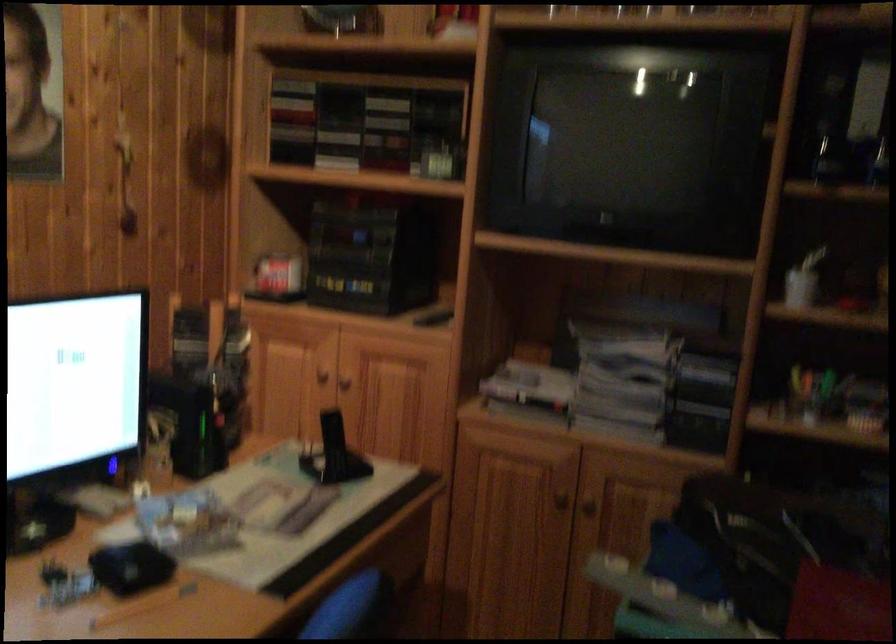
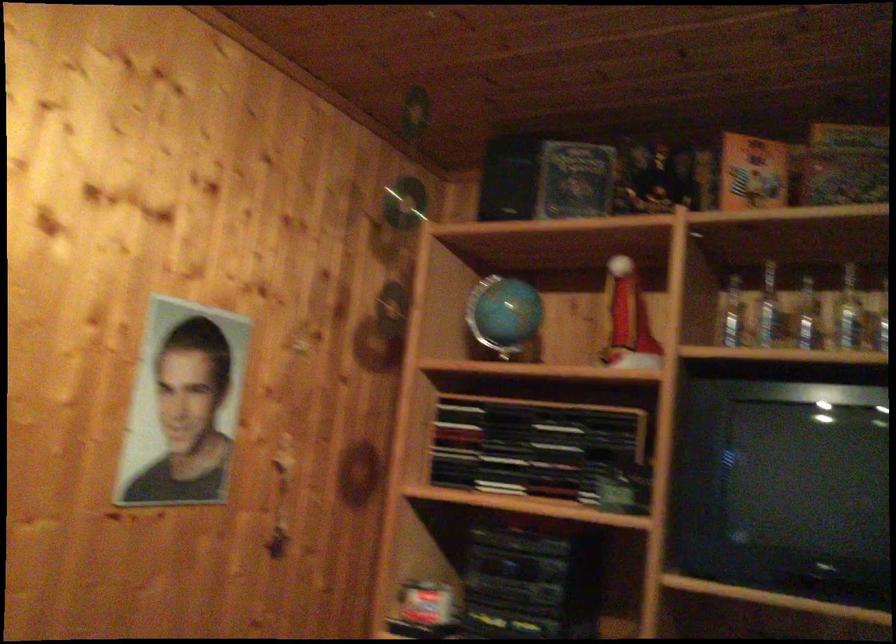
The point at (x=574, y=160) is marked in the first image. Where is the corresponding point in the second image?

(785, 488)